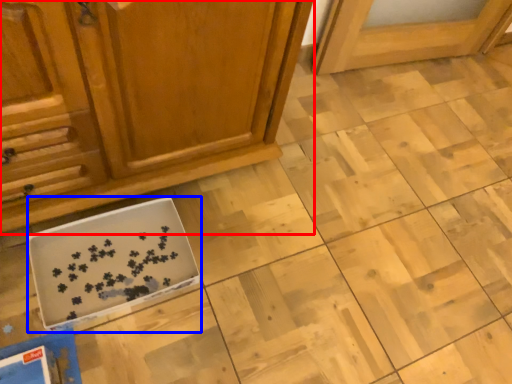
Question: Among these objects, which one is nearest to the camera, cabinetry (highlighted by a red box) or cardboard box (highlighted by a blue box)?

Choices:
 (A) cabinetry
 (B) cardboard box

Answer: (A)